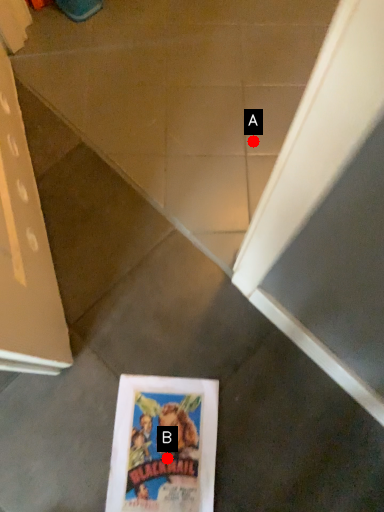
Question: Two points are circled on the image, labeled by A and B beside each circle. Which point appears farthest from the camera in this image?

Choices:
 (A) A is further
 (B) B is further

Answer: (A)